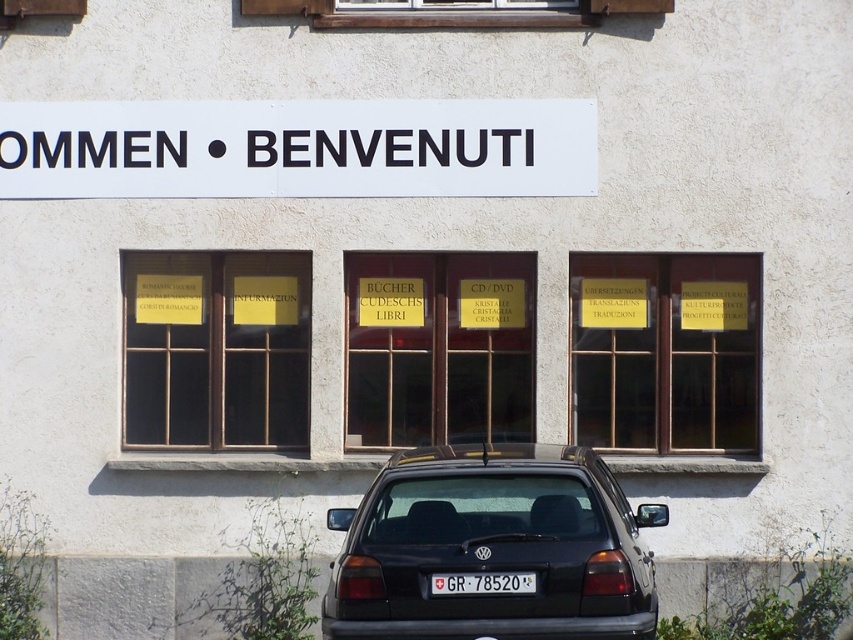
Question: Which object is farther from the camera taking this photo?

Choices:
 (A) white plastic license plate at center
 (B) black matte sedan at center

Answer: (A)

Question: In this image, where is white plastic sign at upper center located relative to white plastic license plate at center?

Choices:
 (A) below
 (B) above

Answer: (B)

Question: Is black matte sedan at center thinner than white plastic sign at upper center?

Choices:
 (A) no
 (B) yes

Answer: (B)

Question: Among these points, which one is nearest to the camera?

Choices:
 (A) (20, 116)
 (B) (495, 586)
 (C) (492, 612)

Answer: (B)

Question: Which object appears closest to the camera in this image?

Choices:
 (A) white plastic license plate at center
 (B) white plastic sign at upper center
 (C) black matte sedan at center

Answer: (C)

Question: Can you confirm if white plastic sign at upper center is positioned below white plastic license plate at center?

Choices:
 (A) no
 (B) yes

Answer: (A)